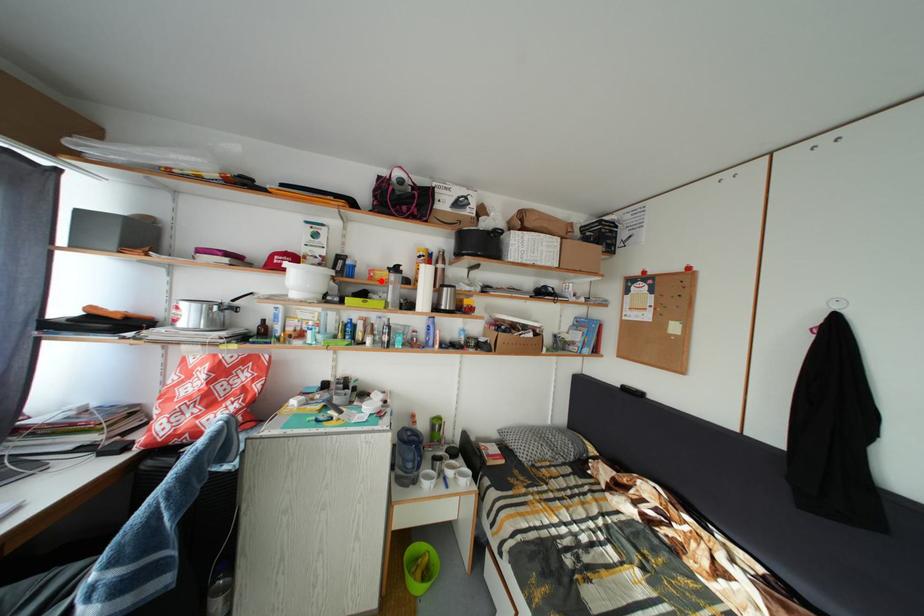
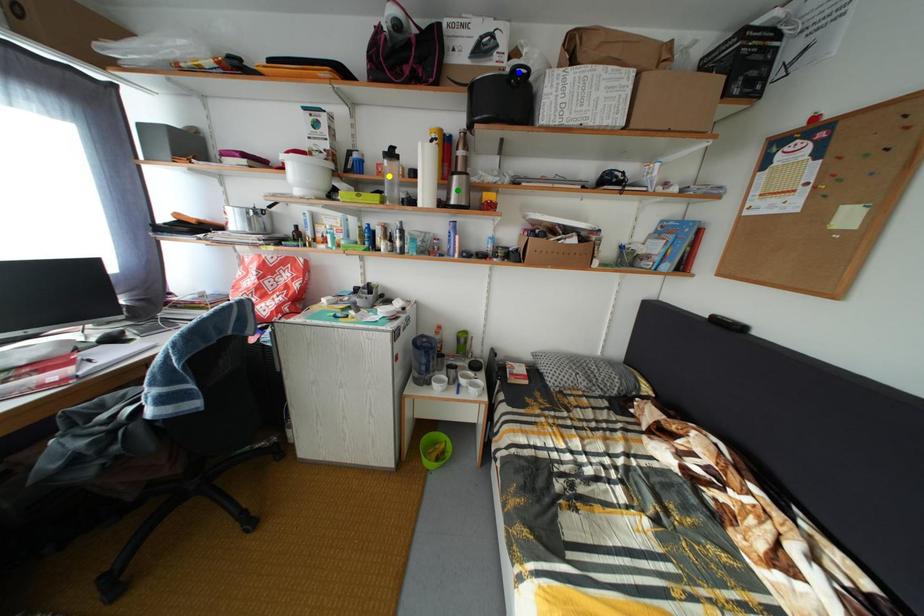
Question: I am providing you with two images of the same scene from different viewpoints. A red point is marked on the first image. You are given multiple points on the second image. In image 2, which mark is for the same physical point as the one in image 1?

Choices:
 (A) blue point
 (B) yellow point
 (C) green point

Answer: (B)